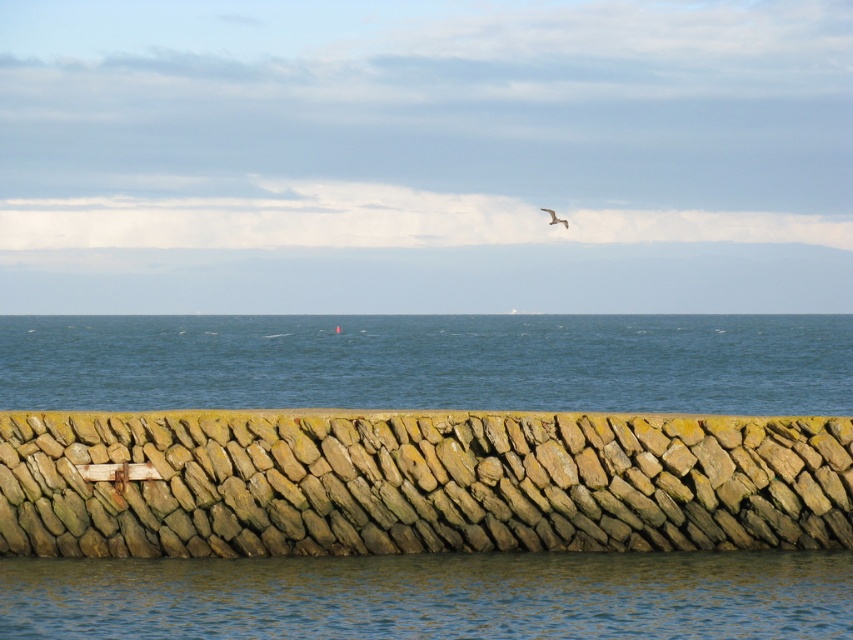
You are a photographer trying to capture the blue water at center and the white feathered bird at upper center in a single shot. Which object will occupy more of the frame in your photo?

The blue water at center will occupy more of the frame because it is bigger than the white feathered bird at upper center.

You are standing at the base of the stone wall in the coastal scene. There are two points marked on the wall. The first point is at coordinates point (x=816, y=529) and the second is at point (x=283, y=346). Which point would you reach first if you start walking towards the wall from your current position?

The point at (x=816, y=529) is closer to the camera than the point at (x=283, y=346), so you would reach the point at (x=816, y=529) first as it is nearer to your current position.